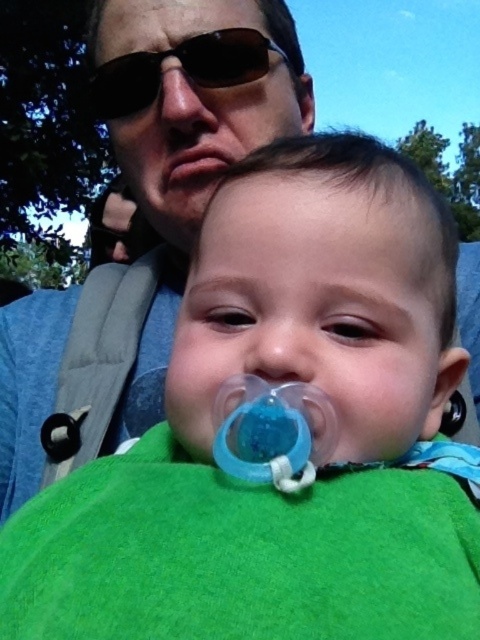
You are a photographer capturing a portrait of the black plastic sunglasses at upper center and the pink flesh at center. Which object is covering the other one?

The black plastic sunglasses at upper center is positioned over pink flesh at center, so the sunglasses are covering the pink flesh at center.

You are a photographer trying to capture a candid shot of the baby and the adult. You need to ensure that both the black plastic sunglasses at upper center and the pink flesh at center are visible in the frame. Based on their sizes, which object should you focus on first to ensure both are in focus?

The black plastic sunglasses at upper center has a lesser height compared to the pink flesh at center, so you should focus on the pink flesh at center first to ensure both are in focus since it is larger and might require more attention to capture details.

You are an observer looking at the image. There is a point labeled as point (x=182, y=68) in the scene. What object is located at that point?

The point (x=182, y=68) corresponds to the black plastic sunglasses at upper center.